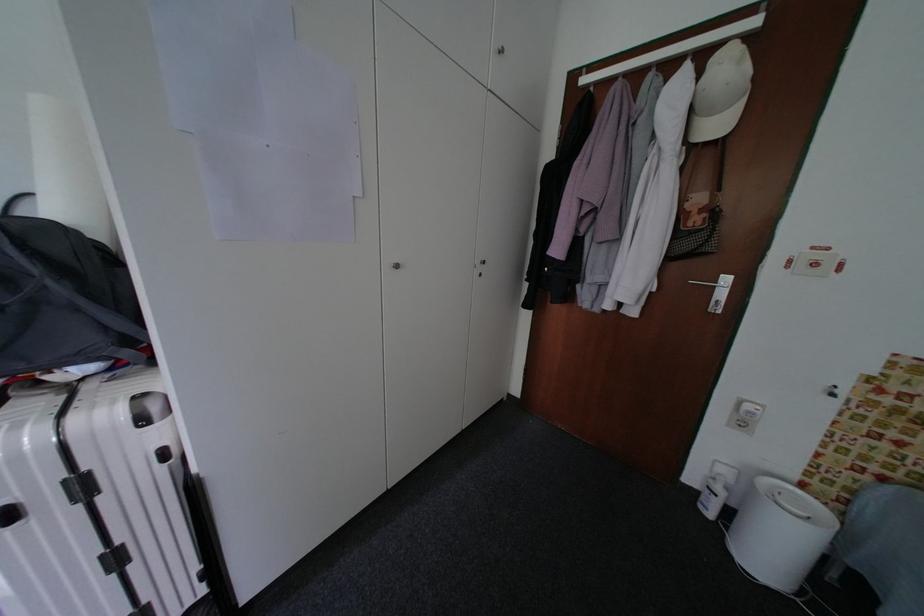
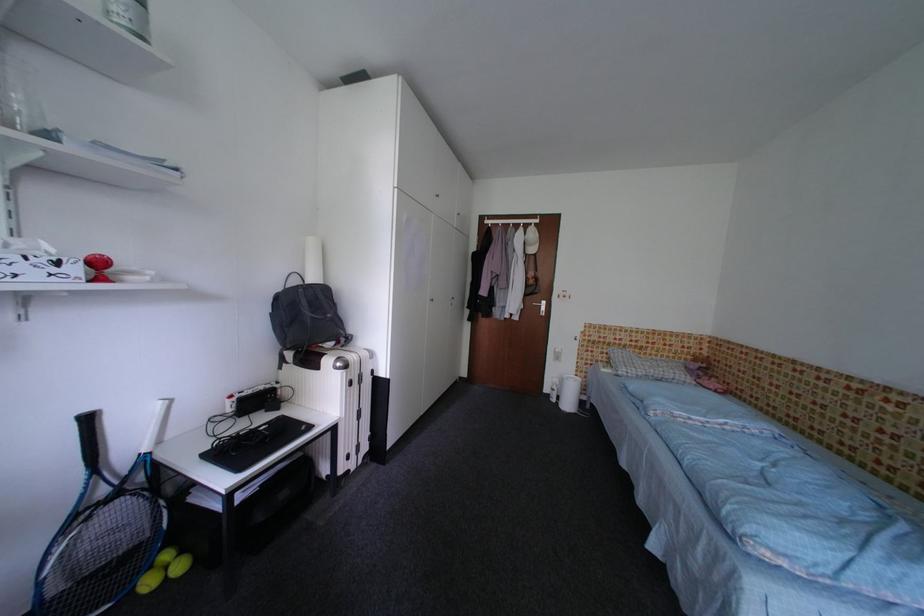
Where in the second image is the point corresponding to the point at 683,268 from the first image?

(536, 300)